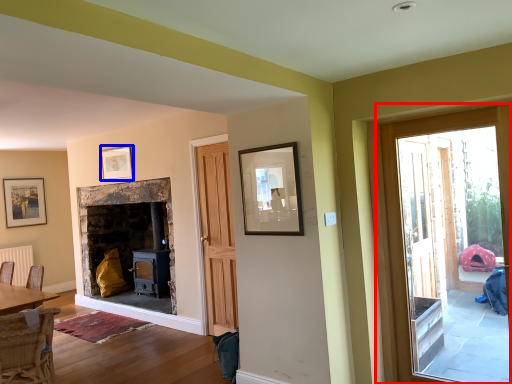
Question: Which object is closer to the camera taking this photo, door (highlighted by a red box) or picture frame (highlighted by a blue box)?

Choices:
 (A) door
 (B) picture frame

Answer: (A)